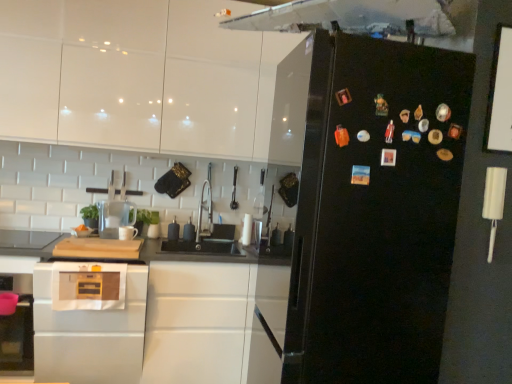
Describe the element at coordinates (376, 211) in the screenshot. The height and width of the screenshot is (384, 512). I see `black glossy refrigerator at right` at that location.

Locate an element on the screen. The width and height of the screenshot is (512, 384). white glossy cabinet at lower left, the second cabinetry viewed from the top is located at coordinates (153, 319).

Measure the distance between point (39, 377) and camera.

Point (39, 377) and camera are 7.96 feet apart.

How much space does white glossy cabinets at upper center, marked as the second cabinetry in a bottom-to-top arrangement, occupy vertically?

white glossy cabinets at upper center, marked as the second cabinetry in a bottom-to-top arrangement, is 1.04 meters tall.

This screenshot has width=512, height=384. What are the coordinates of `black glossy refrigerator at right` in the screenshot? It's located at (376, 211).

Can you confirm if transparent glass pitcher at center is thinner than black glossy refrigerator at right?

Correct, the width of transparent glass pitcher at center is less than that of black glossy refrigerator at right.

Does transparent glass pitcher at center have a larger size compared to black glossy refrigerator at right?

No.

In terms of height, does transparent glass pitcher at center look taller or shorter compared to black glossy refrigerator at right?

Considering their sizes, transparent glass pitcher at center has less height than black glossy refrigerator at right.

Does point (114, 234) appear closer or farther from the camera than point (324, 116)?

Point (114, 234) is positioned farther from the camera compared to point (324, 116).

Considering the sizes of objects white glossy cabinet at lower left, placed as the 1th cabinetry when sorted from bottom to top, and satin silver oven at lower left in the image provided, who is thinner, white glossy cabinet at lower left, placed as the 1th cabinetry when sorted from bottom to top, or satin silver oven at lower left?

Thinner between the two is white glossy cabinet at lower left, placed as the 1th cabinetry when sorted from bottom to top.

Identify the location of home appliance located below the white glossy cabinet at lower left, the second cabinetry viewed from the top (from the image's perspective). (89, 324).

From a real-world perspective, is white glossy cabinet at lower left, the second cabinetry viewed from the top, above or below satin silver oven at lower left?

Clearly, from a real-world perspective, white glossy cabinet at lower left, the second cabinetry viewed from the top, is above satin silver oven at lower left.

From the image's perspective, is white glossy cabinet at lower left, the second cabinetry viewed from the top, under satin silver oven at lower left?

Incorrect, from the image's perspective, white glossy cabinet at lower left, the second cabinetry viewed from the top, is higher than satin silver oven at lower left.

From a real-world perspective, which object stands above the other?

white glossy cabinets at upper center, marked as the second cabinetry in a bottom-to-top arrangement.

Consider the image. Considering the relative sizes of transparent glass pitcher at center and white glossy cabinets at upper center, marked as the second cabinetry in a bottom-to-top arrangement, in the image provided, is transparent glass pitcher at center thinner than white glossy cabinets at upper center, marked as the second cabinetry in a bottom-to-top arrangement,?

Correct, the width of transparent glass pitcher at center is less than that of white glossy cabinets at upper center, marked as the second cabinetry in a bottom-to-top arrangement.

Does point (110, 238) come behind point (112, 4)?

Yes.

Is transparent glass pitcher at center facing away from white glossy cabinets at upper center, marked as the second cabinetry in a bottom-to-top arrangement?

transparent glass pitcher at center is not turned away from white glossy cabinets at upper center, marked as the second cabinetry in a bottom-to-top arrangement.

Who is shorter, white glossy cabinets at upper center, which ranks as the 1th cabinetry in top-to-bottom order, or satin silver oven at lower left?

satin silver oven at lower left.

Is white glossy cabinets at upper center, which ranks as the 1th cabinetry in top-to-bottom order, further to the viewer compared to satin silver oven at lower left?

That is True.

Can you confirm if white glossy cabinets at upper center, marked as the second cabinetry in a bottom-to-top arrangement, is positioned to the right of satin silver oven at lower left?

Indeed, white glossy cabinets at upper center, marked as the second cabinetry in a bottom-to-top arrangement, is positioned on the right side of satin silver oven at lower left.

Does point (112, 76) come behind point (64, 328)?

Yes.

Which cabinetry is the 2nd one when counting from the back of the black glossy refrigerator at right? Please provide its 2D coordinates.

[(142, 78)]

From a real-world perspective, is black glossy refrigerator at right beneath white glossy cabinets at upper center, which ranks as the 1th cabinetry in top-to-bottom order?

Correct, in the physical world, black glossy refrigerator at right is lower than white glossy cabinets at upper center, which ranks as the 1th cabinetry in top-to-bottom order.

Considering the relative sizes of black glossy refrigerator at right and white glossy cabinets at upper center, which ranks as the 1th cabinetry in top-to-bottom order, in the image provided, is black glossy refrigerator at right wider than white glossy cabinets at upper center, which ranks as the 1th cabinetry in top-to-bottom order,?

Yes, black glossy refrigerator at right is wider than white glossy cabinets at upper center, which ranks as the 1th cabinetry in top-to-bottom order.

Visually, is black glossy refrigerator at right positioned to the left or to the right of white glossy cabinets at upper center, which ranks as the 1th cabinetry in top-to-bottom order?

From the image, it's evident that black glossy refrigerator at right is to the right of white glossy cabinets at upper center, which ranks as the 1th cabinetry in top-to-bottom order.

In the scene shown: Is transparent glass pitcher at center positioned with its back to satin silver oven at lower left?

No, transparent glass pitcher at center's orientation is not away from satin silver oven at lower left.

Which is in front, transparent glass pitcher at center or satin silver oven at lower left?

satin silver oven at lower left is in front.

Does transparent glass pitcher at center have a lesser width compared to satin silver oven at lower left?

Correct, the width of transparent glass pitcher at center is less than that of satin silver oven at lower left.

Is transparent glass pitcher at center directly adjacent to satin silver oven at lower left?

transparent glass pitcher at center is not next to satin silver oven at lower left, and they're not touching.

Is black glossy refrigerator at right not inside white glossy cabinet at lower left, placed as the 1th cabinetry when sorted from bottom to top?

black glossy refrigerator at right is positioned outside white glossy cabinet at lower left, placed as the 1th cabinetry when sorted from bottom to top.

Can you confirm if black glossy refrigerator at right is bigger than white glossy cabinet at lower left, the second cabinetry viewed from the top?

Actually, black glossy refrigerator at right might be smaller than white glossy cabinet at lower left, the second cabinetry viewed from the top.

From the image's perspective, between black glossy refrigerator at right and white glossy cabinet at lower left, the second cabinetry viewed from the top, which one is located above?

From the image's view, black glossy refrigerator at right is above.

Identify the location of refrigerator below the transparent glass pitcher at center (from the image's perspective). The height and width of the screenshot is (384, 512). (376, 211).

From the satin silver oven at lower left, count 1st cabinetrys backward and point to it. Please provide its 2D coordinates.

[(153, 319)]

Looking at the image, which one is located further to transparent glass pitcher at center, white glossy cabinet at lower left, placed as the 1th cabinetry when sorted from bottom to top, or satin silver oven at lower left?

white glossy cabinet at lower left, placed as the 1th cabinetry when sorted from bottom to top, is further to transparent glass pitcher at center.

From the image, which object appears to be farther from white glossy cabinet at lower left, placed as the 1th cabinetry when sorted from bottom to top, satin silver oven at lower left or black glossy refrigerator at right?

Based on the image, black glossy refrigerator at right appears to be further to white glossy cabinet at lower left, placed as the 1th cabinetry when sorted from bottom to top.

Based on their spatial positions, is satin silver oven at lower left or transparent glass pitcher at center closer to white glossy cabinet at lower left, the second cabinetry viewed from the top?

Based on the image, satin silver oven at lower left appears to be nearer to white glossy cabinet at lower left, the second cabinetry viewed from the top.

Looking at the image, which one is located closer to black glossy refrigerator at right, white glossy cabinets at upper center, marked as the second cabinetry in a bottom-to-top arrangement, or transparent glass pitcher at center?

white glossy cabinets at upper center, marked as the second cabinetry in a bottom-to-top arrangement, lies closer to black glossy refrigerator at right than the other object.

Based on their spatial positions, is black glossy refrigerator at right or white glossy cabinets at upper center, which ranks as the 1th cabinetry in top-to-bottom order, closer to white glossy cabinet at lower left, placed as the 1th cabinetry when sorted from bottom to top?

white glossy cabinets at upper center, which ranks as the 1th cabinetry in top-to-bottom order, lies closer to white glossy cabinet at lower left, placed as the 1th cabinetry when sorted from bottom to top, than the other object.

When comparing their distances from black glossy refrigerator at right, does transparent glass pitcher at center or white glossy cabinet at lower left, placed as the 1th cabinetry when sorted from bottom to top, seem closer?

white glossy cabinet at lower left, placed as the 1th cabinetry when sorted from bottom to top.

Estimate the real-world distances between objects in this image. Which object is further from white glossy cabinets at upper center, marked as the second cabinetry in a bottom-to-top arrangement, black glossy refrigerator at right or white glossy cabinet at lower left, the second cabinetry viewed from the top?

Among the two, black glossy refrigerator at right is located further to white glossy cabinets at upper center, marked as the second cabinetry in a bottom-to-top arrangement.

Considering their positions, is white glossy cabinets at upper center, marked as the second cabinetry in a bottom-to-top arrangement, positioned further to transparent glass pitcher at center than black glossy refrigerator at right?

black glossy refrigerator at right lies further to transparent glass pitcher at center than the other object.

In order to click on cabinetry between white glossy cabinets at upper center, which ranks as the 1th cabinetry in top-to-bottom order, and satin silver oven at lower left from top to bottom in this screenshot , I will do `click(153, 319)`.

You are a GUI agent. You are given a task and a screenshot of the screen. Output one action in this format:
    pyautogui.click(x=<x>, y=<y>)
    Task: Click on the refrigerator between white glossy cabinets at upper center, which ranks as the 1th cabinetry in top-to-bottom order, and satin silver oven at lower left vertically
    This screenshot has height=384, width=512.
    Given the screenshot: What is the action you would take?
    pyautogui.click(x=376, y=211)

Find the location of a particular element. kitchen appliance that lies between white glossy cabinets at upper center, marked as the second cabinetry in a bottom-to-top arrangement, and satin silver oven at lower left from top to bottom is located at coordinates (115, 211).

I want to click on refrigerator between white glossy cabinets at upper center, marked as the second cabinetry in a bottom-to-top arrangement, and white glossy cabinet at lower left, the second cabinetry viewed from the top, in the vertical direction, so click(376, 211).